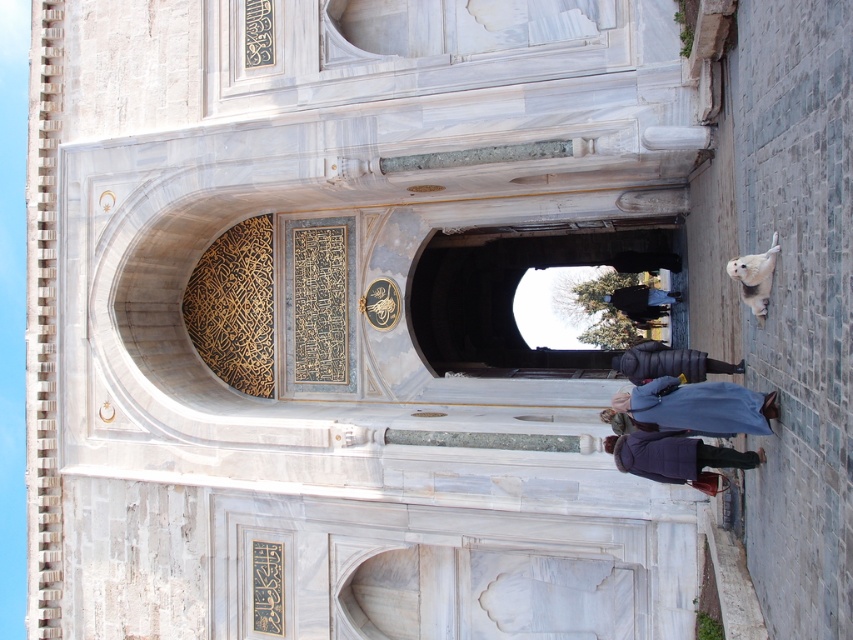
Which is more to the right, blue wool coat at lower right or dark blue down jacket at lower center?

blue wool coat at lower right

Locate an element on the screen. blue wool coat at lower right is located at coordinates (698, 406).

Where is `blue wool coat at lower right`? This screenshot has height=640, width=853. blue wool coat at lower right is located at coordinates (698, 406).

The width and height of the screenshot is (853, 640). Identify the location of blue wool coat at lower right. (698, 406).